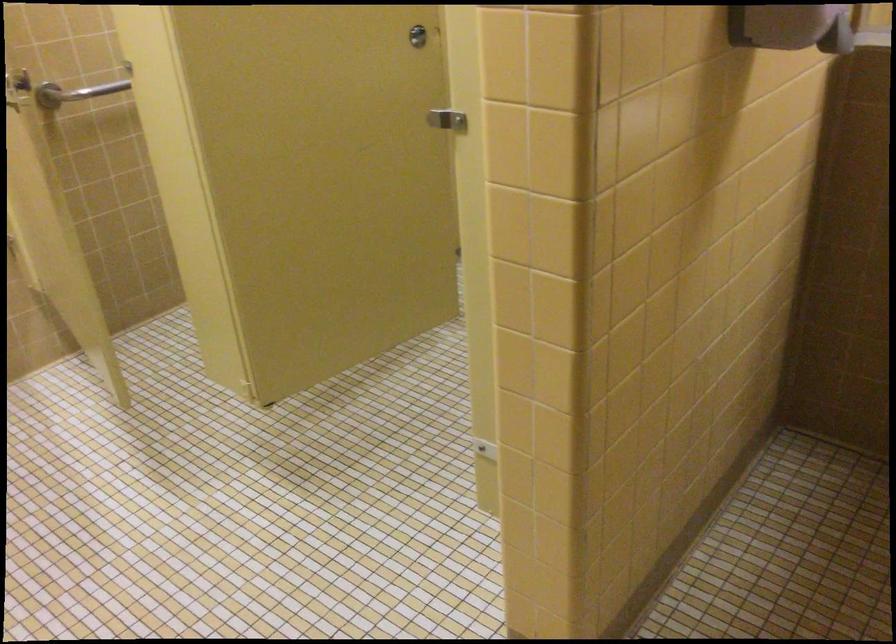
Identify the location of stall door lock. (420, 35).